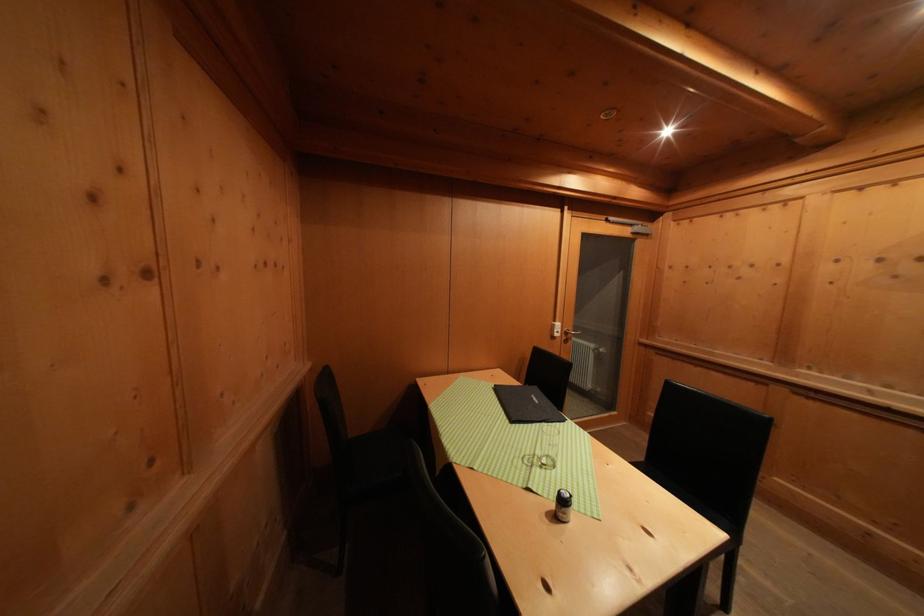
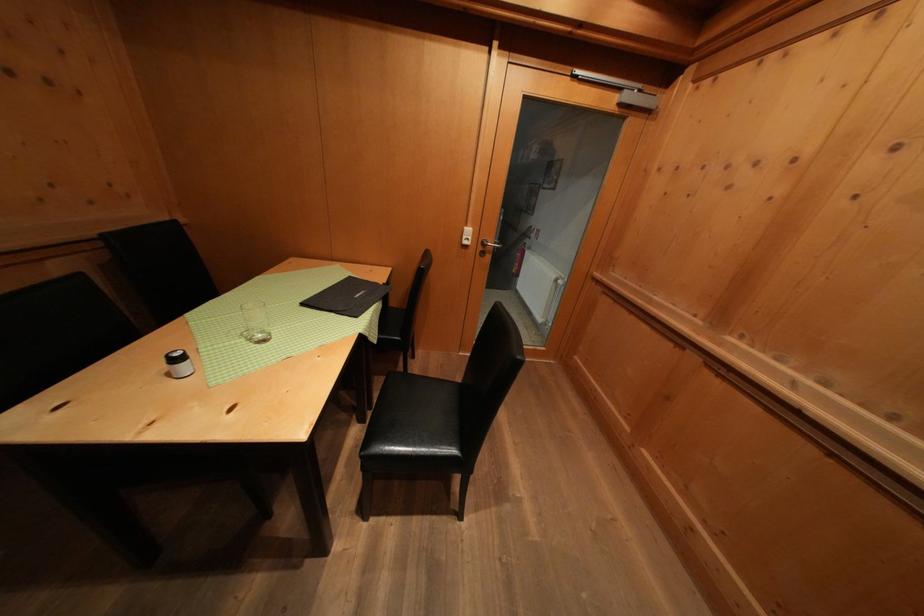
Where in the second image is the point corresponding to the point at 572,339 from the first image?

(490, 249)